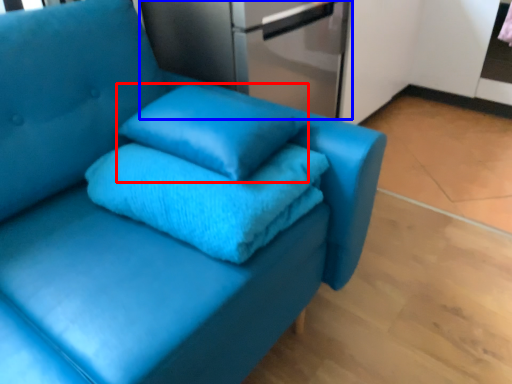
Question: Which object is further to the camera taking this photo, pillow (highlighted by a red box) or appliance (highlighted by a blue box)?

Choices:
 (A) pillow
 (B) appliance

Answer: (B)